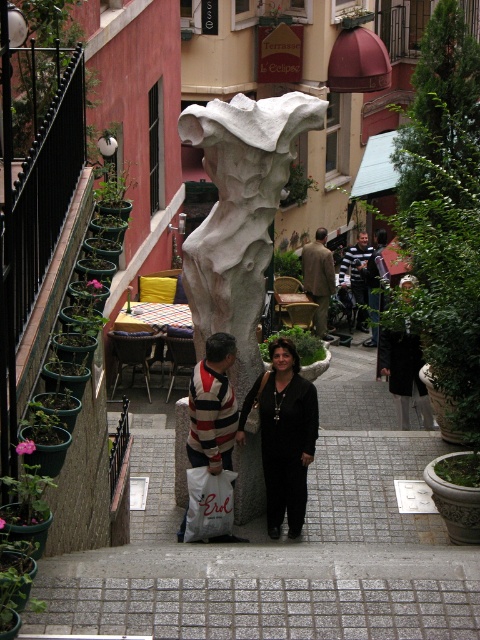
You are a tourist standing in the alleyway and want to take a photo of both the white stone statue at center and the black matte dress at center. Which object should you focus on first to ensure both are in frame?

You should focus on the white stone statue at center first because it is taller than the black matte dress at center, so adjusting the camera angle to include its height will naturally include the shorter object as well.

You are a tourist standing at the entrance of the alleyway and want to take a photo of the white stone statue at center. Based on your position, is the statue located to your left, right, or directly in front of you?

The white stone statue at center is positioned at point 0.334 on the x and y axis, so it is directly in front of you.